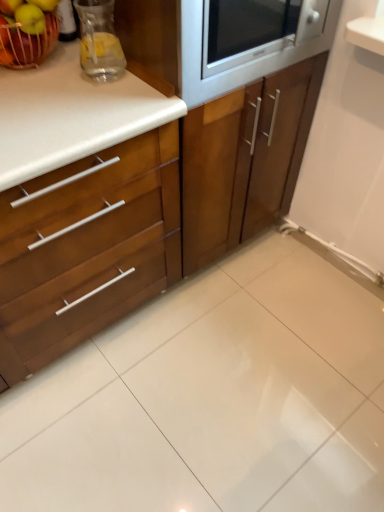
Image resolution: width=384 pixels, height=512 pixels. What are the coordinates of `free space in front of clear glass pitcher at upper left` in the screenshot? It's located at (87, 102).